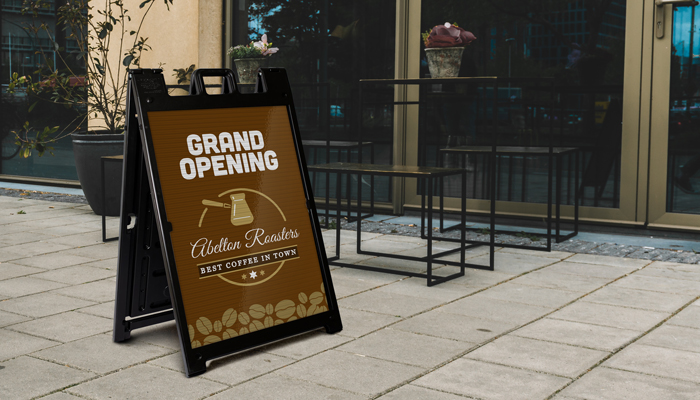
You are a GUI agent. You are given a task and a screenshot of the screen. Output one action in this format:
    pyautogui.click(x=<x>, y=<y>)
    Task: Click on the plant pot
    
    Given the screenshot: What is the action you would take?
    pyautogui.click(x=440, y=50)